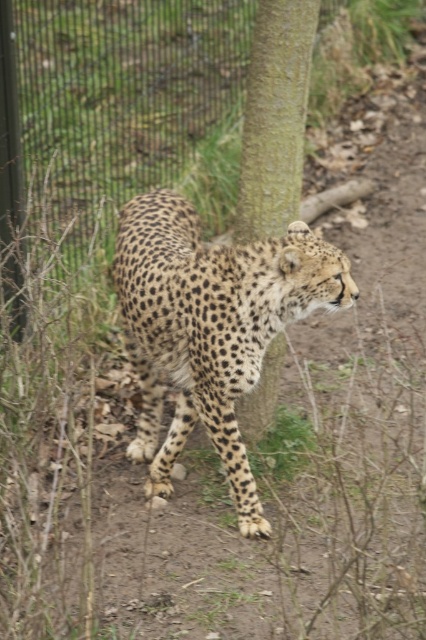
Based on the coordinates provided, where is the spotted fur cheetah at center located in the image?

The spotted fur cheetah at center is located at the coordinates point (210,326).

You are a zookeeper observing the spotted fur cheetah at center and the green textured bark at center in the enclosure. Which object would appear bigger to a visitor standing directly in front of the enclosure?

The spotted fur cheetah at center has a larger size compared to the green textured bark at center, so it would appear bigger to the visitor standing directly in front of the enclosure.